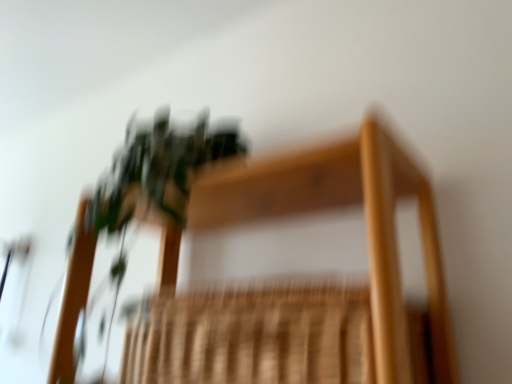
Where is `green leafy plant at upper center`? This screenshot has width=512, height=384. green leafy plant at upper center is located at coordinates (133, 212).

Measure the distance between green leafy plant at upper center and camera.

The distance of green leafy plant at upper center from camera is 27.44 inches.

What is the approximate height of green leafy plant at upper center?

green leafy plant at upper center is 22.64 inches in height.

What do you see at coordinates (133, 212) in the screenshot? The height and width of the screenshot is (384, 512). I see `green leafy plant at upper center` at bounding box center [133, 212].

Identify the location of green leafy plant at upper center. Image resolution: width=512 pixels, height=384 pixels. (133, 212).